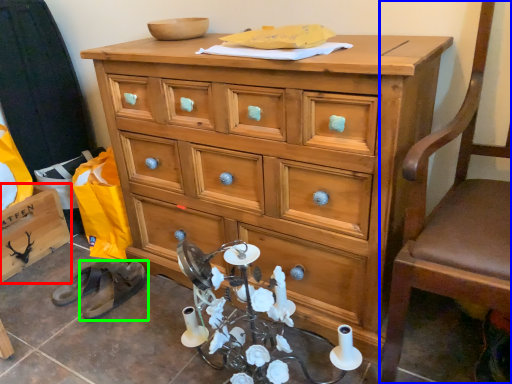
Question: Which object is the farthest from cabinetry (highlighted by a red box)? Choose among these: swivel chair (highlighted by a blue box) or footwear (highlighted by a green box).

Choices:
 (A) swivel chair
 (B) footwear

Answer: (A)